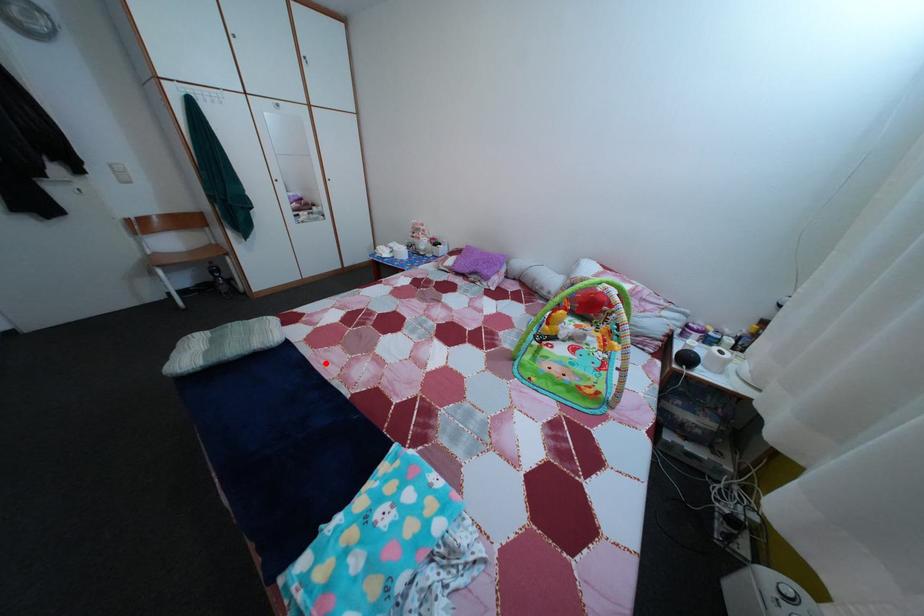
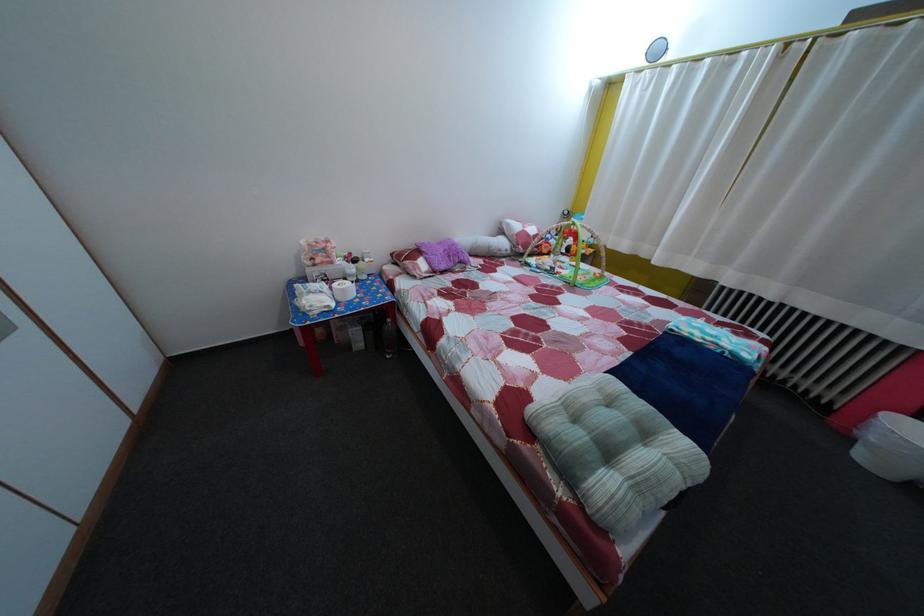
Where in the second image is the point corresponding to the highlighted location from the first image?

(601, 379)